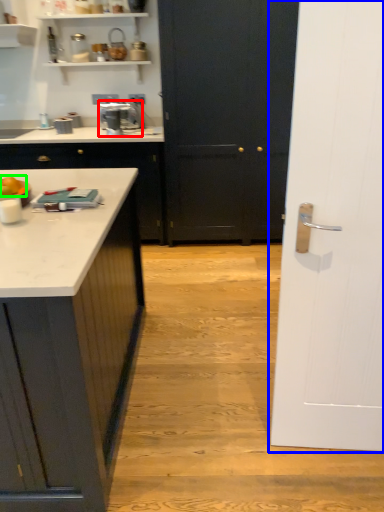
Question: Which is nearer to the home appliance (highlighted by a red box)? door (highlighted by a blue box) or food (highlighted by a green box).

Choices:
 (A) door
 (B) food

Answer: (B)